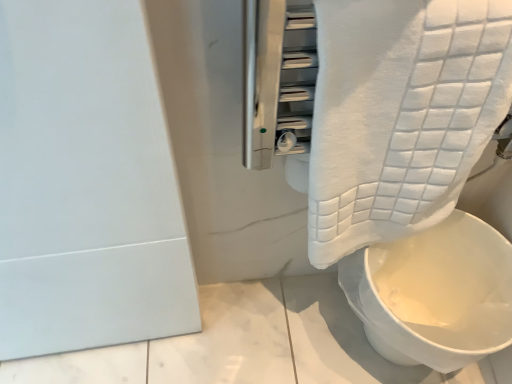
You are a GUI agent. You are given a task and a screenshot of the screen. Output one action in this format:
    pyautogui.click(x=<x>, y=<y>)
    Task: Click on the free space to the left of white fabric toilet at lower right
    Image resolution: width=512 pixels, height=384 pixels.
    Given the screenshot: What is the action you would take?
    pyautogui.click(x=260, y=326)